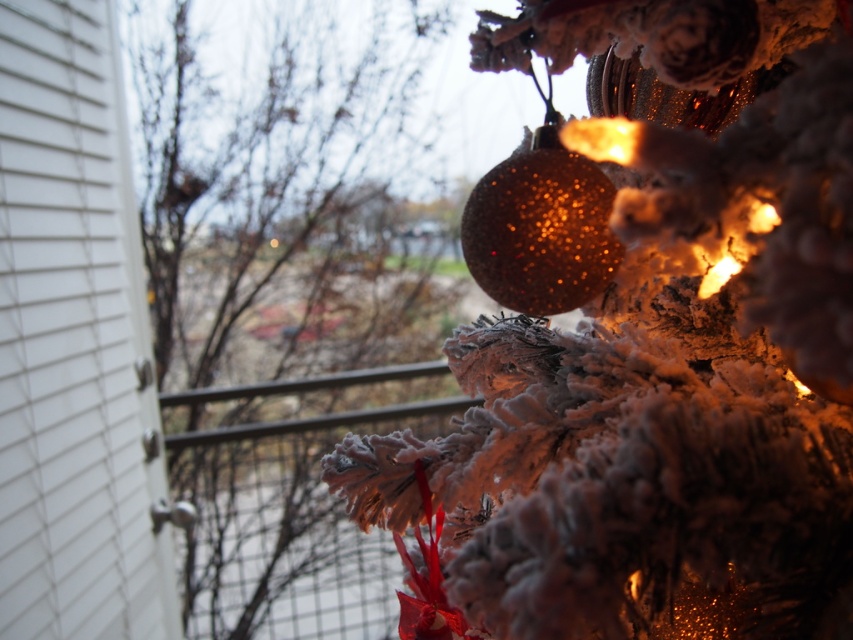
Question: Does frosted pine cone at right appear over glittery gold ornament at upper center?

Choices:
 (A) yes
 (B) no

Answer: (B)

Question: Does frosted pine cone at right appear on the right side of white textured siding at left?

Choices:
 (A) yes
 (B) no

Answer: (A)

Question: Among these objects, which one is nearest to the camera?

Choices:
 (A) frosted pine cone at right
 (B) sparkling gold ornament at upper right
 (C) white textured siding at left

Answer: (B)

Question: Which is nearer to the white textured siding at left?

Choices:
 (A) sparkling gold ornament at upper right
 (B) glittery gold ornament at upper center
 (C) frosted pine cone at right

Answer: (C)

Question: Which object is closer to the camera taking this photo?

Choices:
 (A) glittery gold ornament at upper center
 (B) sparkling gold ornament at upper right
 (C) frosted pine cone at right

Answer: (B)

Question: Is sparkling gold ornament at upper right further to camera compared to frosted pine cone at right?

Choices:
 (A) yes
 (B) no

Answer: (B)